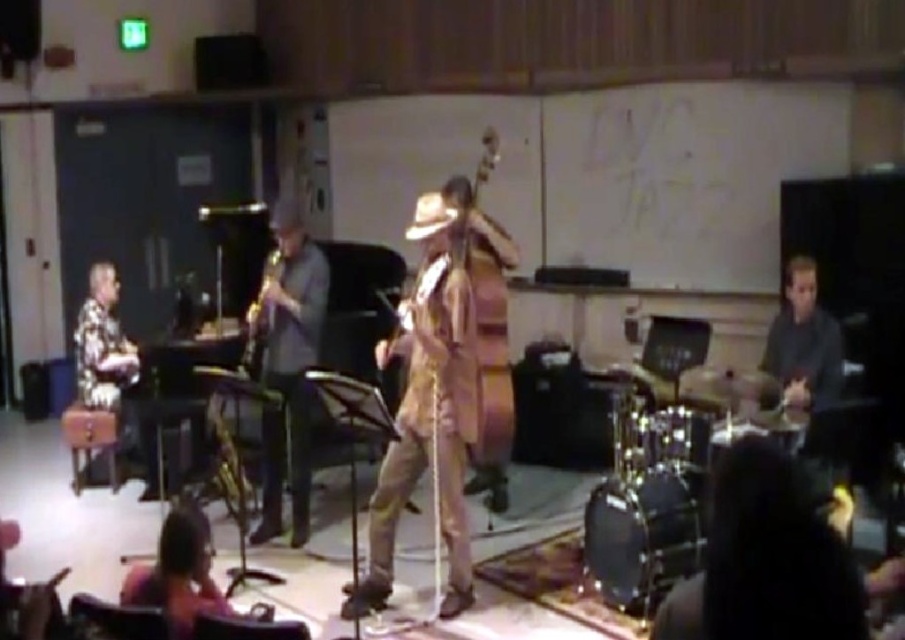
Question: Considering the real-world distances, which object is farthest from the camouflage-patterned pantsuit at center?

Choices:
 (A) shiny gold saxophone at center
 (B) gold metallic saxophone at center
 (C) wooden polished cello at center

Answer: (B)

Question: Does shiny gold saxophone at center have a lesser width compared to dark brown leather jacket at lower left?

Choices:
 (A) no
 (B) yes

Answer: (A)

Question: Which is nearer to the dark brown leather jacket at lower left?

Choices:
 (A) shiny gold saxophone at center
 (B) wooden polished cello at center
 (C) black leather jacket at lower right
 (D) camouflage-patterned pantsuit at center

Answer: (D)

Question: Does camouflage-patterned pantsuit at center have a smaller size compared to dark brown leather jacket at lower left?

Choices:
 (A) no
 (B) yes

Answer: (A)

Question: Which of the following is the closest to the observer?

Choices:
 (A) (260, 346)
 (B) (207, 554)

Answer: (B)

Question: Is black leather jacket at lower right to the left of wooden polished cello at center from the viewer's perspective?

Choices:
 (A) yes
 (B) no

Answer: (B)